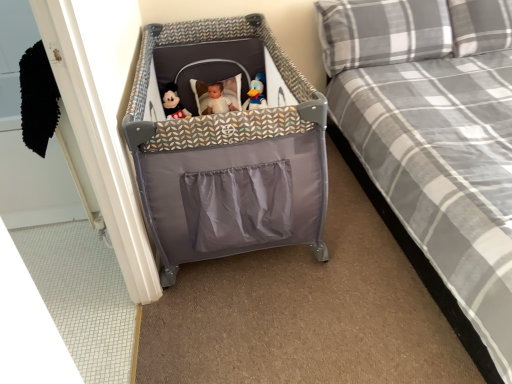
Question: Is plaid fabric bed at center closer to camera compared to matte plush mickey mouse at center?

Choices:
 (A) yes
 (B) no

Answer: (A)

Question: Is plaid fabric bed at center next to matte plush mickey mouse at center?

Choices:
 (A) no
 (B) yes

Answer: (A)

Question: Is matte plush mickey mouse at center inside plaid fabric bed at center?

Choices:
 (A) yes
 (B) no

Answer: (B)

Question: From the image's perspective, is plaid fabric bed at center above matte plush mickey mouse at center?

Choices:
 (A) no
 (B) yes

Answer: (A)

Question: Is plaid fabric bed at center aimed at matte plush mickey mouse at center?

Choices:
 (A) yes
 (B) no

Answer: (B)

Question: Considering the positions of gray plaid pillow at upper right, the first pillow from the right, and plaid fabric bed at center in the image, is gray plaid pillow at upper right, the first pillow from the right, taller or shorter than plaid fabric bed at center?

Choices:
 (A) short
 (B) tall

Answer: (A)

Question: Is point (453, 18) closer or farther from the camera than point (431, 57)?

Choices:
 (A) closer
 (B) farther

Answer: (A)

Question: Considering the positions of gray plaid pillow at upper right, the second pillow from the left, and plaid fabric bed at center in the image, is gray plaid pillow at upper right, the second pillow from the left, bigger or smaller than plaid fabric bed at center?

Choices:
 (A) big
 (B) small

Answer: (B)

Question: In the image, is gray plaid pillow at upper right, the second pillow from the left, on the left side or the right side of plaid fabric bed at center?

Choices:
 (A) right
 (B) left

Answer: (A)

Question: Is gray plaid pillow at upper right, marked as the first pillow in a left-to-right arrangement, wider or thinner than matte plush mickey mouse at center?

Choices:
 (A) wide
 (B) thin

Answer: (A)

Question: Is point (413, 21) positioned closer to the camera than point (164, 89)?

Choices:
 (A) closer
 (B) farther

Answer: (A)

Question: In terms of height, does gray plaid pillow at upper right, marked as the first pillow in a left-to-right arrangement, look taller or shorter compared to matte plush mickey mouse at center?

Choices:
 (A) short
 (B) tall

Answer: (B)

Question: From a real-world perspective, is gray plaid pillow at upper right, which is the second pillow in right-to-left order, positioned above or below matte plush mickey mouse at center?

Choices:
 (A) above
 (B) below

Answer: (A)

Question: Is point (175, 97) positioned closer to the camera than point (256, 96)?

Choices:
 (A) closer
 (B) farther

Answer: (B)

Question: From the image's perspective, is matte plush mickey mouse at center above or below blue plush duck at center?

Choices:
 (A) below
 (B) above

Answer: (A)